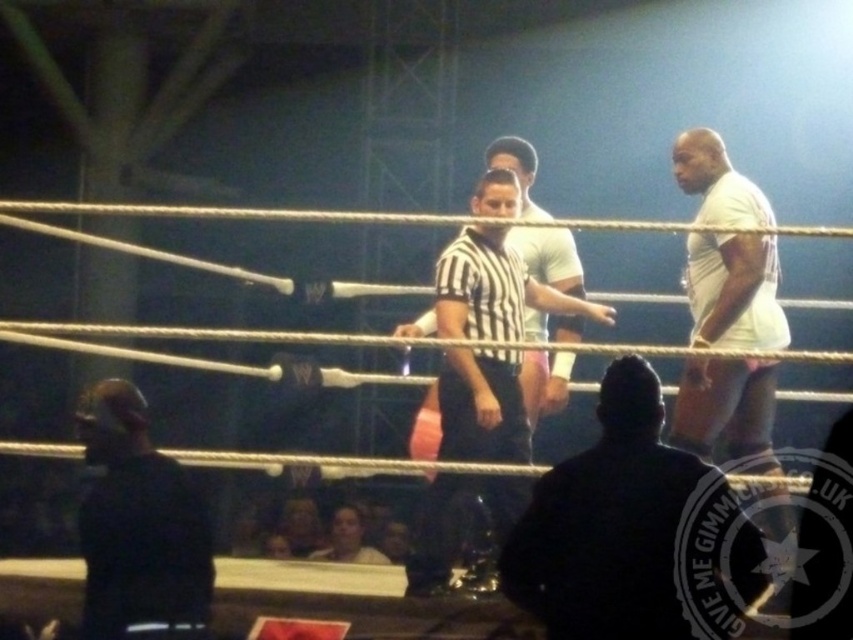
Question: Based on their relative distances, which object is farther from the black striped shirt at center?

Choices:
 (A) dark gray suit at center
 (B) white matte shirt at right
 (C) black matte jacket at lower left

Answer: (C)

Question: In this image, where is black striped shirt at center located relative to black matte jacket at lower left?

Choices:
 (A) left
 (B) right

Answer: (B)

Question: Is the position of white matte shirt at right less distant than that of black matte jacket at lower left?

Choices:
 (A) no
 (B) yes

Answer: (A)

Question: Can you confirm if black striped shirt at center is positioned above white matte shirt at right?

Choices:
 (A) yes
 (B) no

Answer: (B)

Question: Estimate the real-world distances between objects in this image. Which object is farther from the black striped shirt at center?

Choices:
 (A) white matte shirt at right
 (B) black matte jacket at lower left
 (C) dark gray suit at center

Answer: (B)

Question: Which object is positioned farthest from the white matte shirt at right?

Choices:
 (A) black matte jacket at lower left
 (B) black striped shirt at center
 (C) dark gray suit at center

Answer: (A)